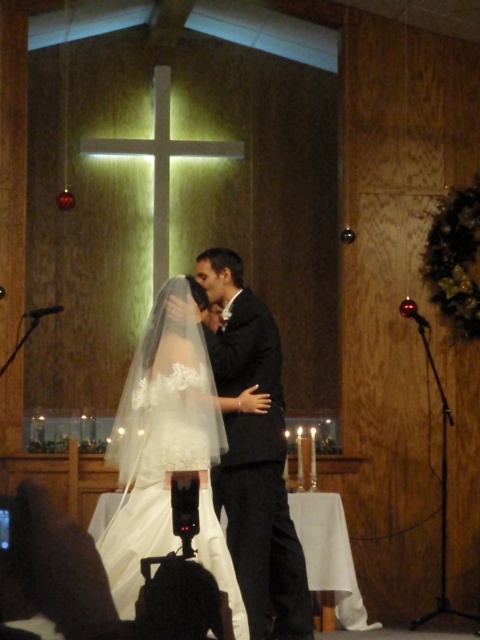
Question: Which of the following is the farthest from the observer?

Choices:
 (A) white lace veil at center
 (B) black satin suit at center

Answer: (B)

Question: Is white lace veil at center smaller than black satin suit at center?

Choices:
 (A) yes
 (B) no

Answer: (B)

Question: Does white lace veil at center have a smaller size compared to black satin suit at center?

Choices:
 (A) yes
 (B) no

Answer: (B)

Question: Among these points, which one is nearest to the camera?

Choices:
 (A) (212, 360)
 (B) (143, 452)

Answer: (B)

Question: Is white lace veil at center above black satin suit at center?

Choices:
 (A) yes
 (B) no

Answer: (A)